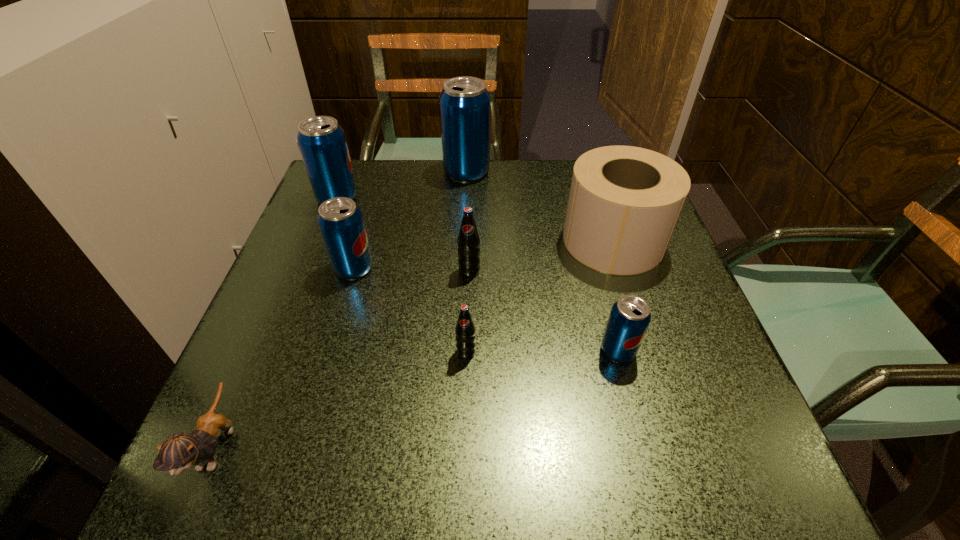
The height and width of the screenshot is (540, 960). I want to click on the biggest blue pop soda, so click(x=465, y=105).

This screenshot has width=960, height=540. I want to click on the farthest object, so click(x=465, y=105).

The height and width of the screenshot is (540, 960). In order to click on the fifth shortest pop in this screenshot , I will do `click(322, 142)`.

Find the location of `the second biggest blue pop soda`. the second biggest blue pop soda is located at coordinates (322, 142).

The image size is (960, 540). I want to click on toilet tissue, so click(x=624, y=203).

The image size is (960, 540). I want to click on the second nearest blue pop soda, so click(340, 221).

Image resolution: width=960 pixels, height=540 pixels. I want to click on the farther black pop, so click(468, 241).

Where is `the nearest blue pop soda`? The image size is (960, 540). the nearest blue pop soda is located at coordinates (630, 316).

The image size is (960, 540). What are the coordinates of `the rightmost pop` in the screenshot? It's located at (630, 316).

The width and height of the screenshot is (960, 540). Find the location of `the nearer black pop`. the nearer black pop is located at coordinates (465, 330).